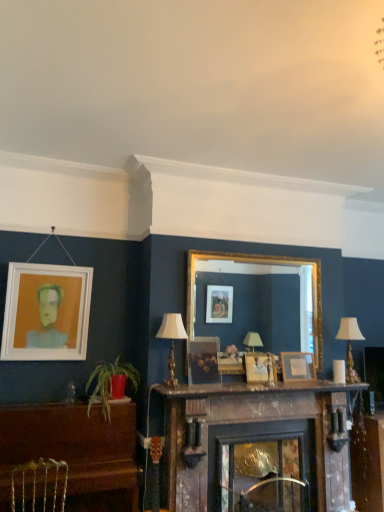
I want to click on free space underneath white matte picture frame at upper left, acting as the first picture frame starting from the left (from a real-world perspective), so click(x=33, y=397).